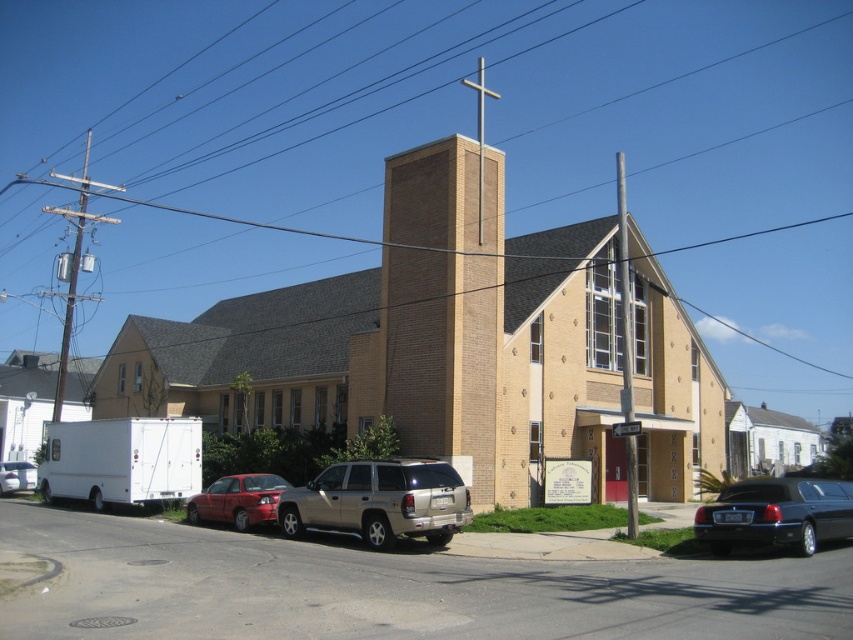
You are a delivery driver who needs to park your truck between the silver metallic suv at center and the matte white van at left. Based on their positions, can you fit your truck there?

The silver metallic suv at center is above the matte white van at left, so there is space between them where you can park your truck.

You are a delivery driver who needs to park your vehicle between the shiny black limousine at lower right and the shiny red sedan at lower left. Is there enough space for your truck, which is 8 meters long?

The shiny black limousine at lower right is positioned on the right side of the shiny red sedan at lower left. Since the distance between them isn not specified, it is impossible to determine if there is enough space for an 8 meter long truck.